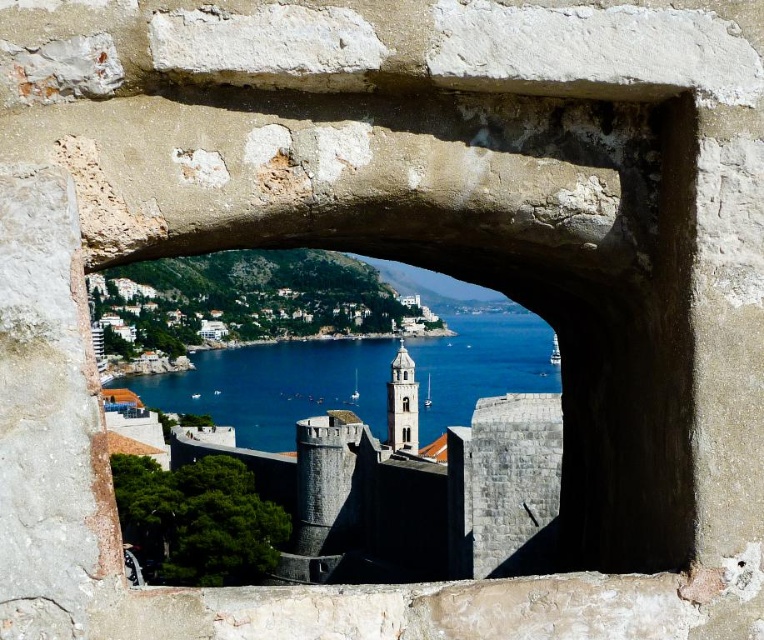
Question: Does white stone tower at center have a lesser width compared to clear glass bell tower at center?

Choices:
 (A) yes
 (B) no

Answer: (B)

Question: Estimate the real-world distances between objects in this image. Which object is closer to the transparent glass window at center?

Choices:
 (A) clear glass window at center
 (B) clear glass bell tower at center

Answer: (A)

Question: Is white stone tower at center behind clear glass bell tower at center?

Choices:
 (A) no
 (B) yes

Answer: (A)

Question: Considering the real-world distances, which object is farthest from the blue water at center?

Choices:
 (A) clear glass window at center
 (B) transparent glass window at center

Answer: (B)

Question: Among these points, which one is farthest from the camera?

Choices:
 (A) (408, 404)
 (B) (397, 433)
 (C) (403, 372)

Answer: (C)

Question: Can you confirm if white stone tower at center is positioned above clear glass bell tower at center?

Choices:
 (A) no
 (B) yes

Answer: (A)